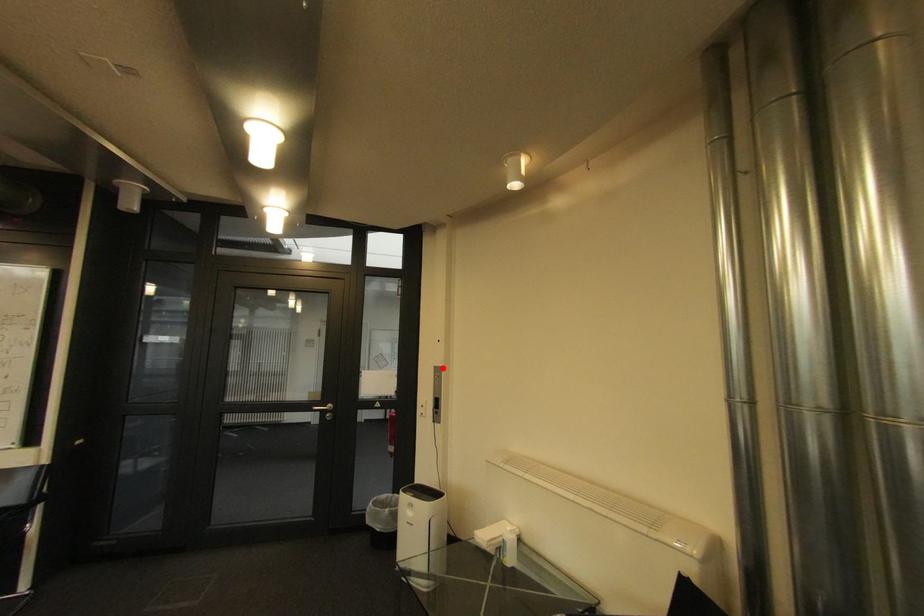
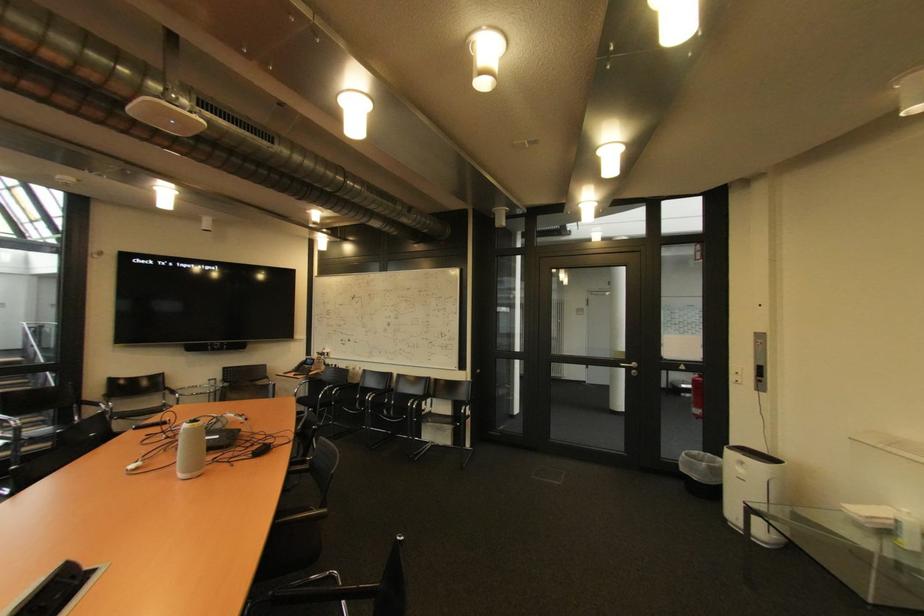
The point at the highlighted location is marked in the first image. Where is the corresponding point in the second image?

(763, 334)